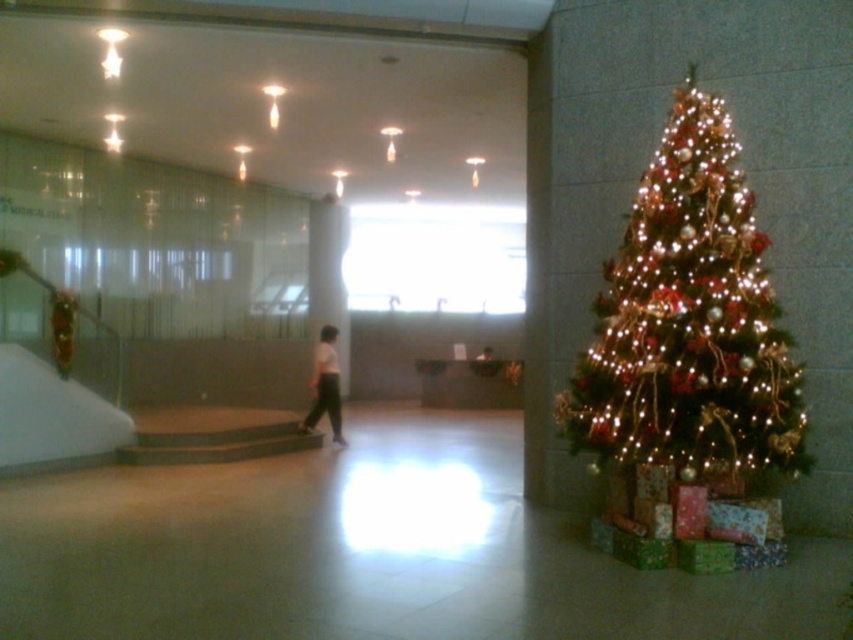
Describe the element at coordinates (688, 321) in the screenshot. Image resolution: width=853 pixels, height=640 pixels. I see `iridescent gold christmas tree at right` at that location.

Which is below, iridescent gold christmas tree at right or white matte pants at center?

white matte pants at center is below.

Is point (630, 355) behind point (337, 404)?

No, it is in front of (337, 404).

Locate an element on the screen. iridescent gold christmas tree at right is located at coordinates (688, 321).